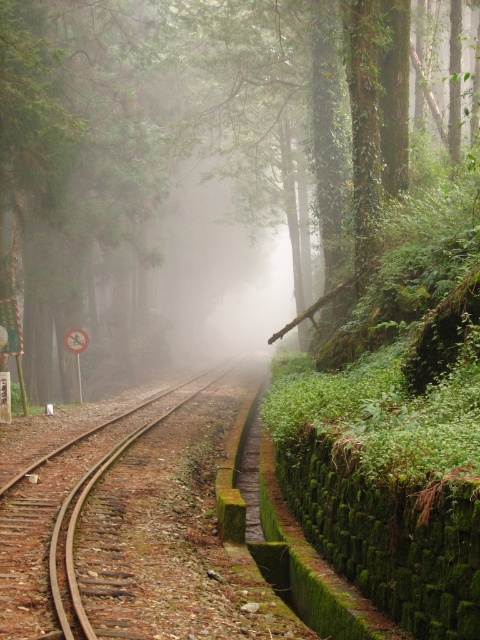
Question: Which of the following is the closest to the observer?

Choices:
 (A) (33, 588)
 (B) (333, 204)

Answer: (A)

Question: Can you confirm if green leafy tree at center is wider than rusty metal train track at center?

Choices:
 (A) yes
 (B) no

Answer: (A)

Question: Can you confirm if green leafy tree at center is positioned to the right of rusty metal train track at center?

Choices:
 (A) no
 (B) yes

Answer: (A)

Question: Is green leafy tree at center to the right of rusty metal train track at center from the viewer's perspective?

Choices:
 (A) yes
 (B) no

Answer: (B)

Question: Which point is closer to the camera?

Choices:
 (A) (29, 532)
 (B) (41, 289)

Answer: (A)